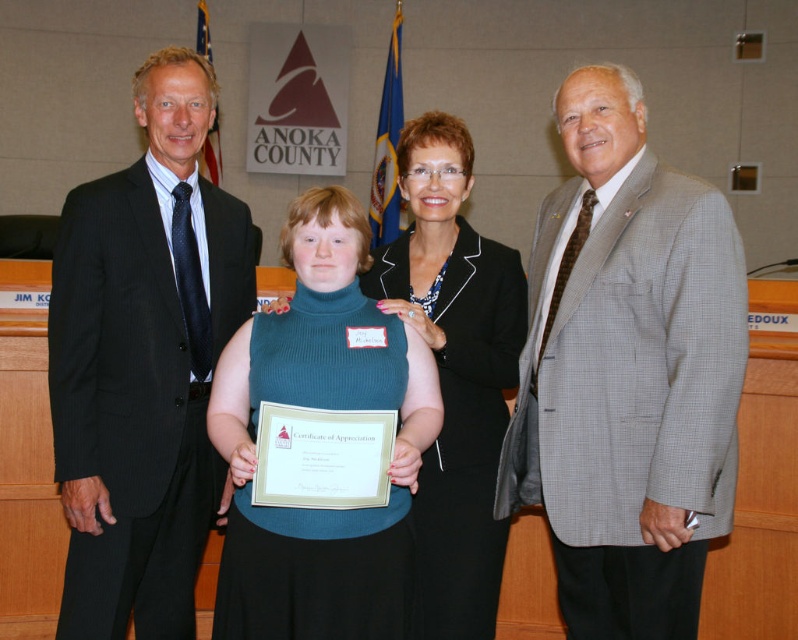
Does black suit at left appear on the right side of black wool suit at center?

In fact, black suit at left is to the left of black wool suit at center.

Is black suit at left behind black wool suit at center?

Yes, it is.

Find the location of a particular element. black suit at left is located at coordinates (143, 362).

Locate an element on the screen. This screenshot has height=640, width=798. black suit at left is located at coordinates (143, 362).

Does teal turtleneck sweater at center have a larger size compared to black wool suit at center?

Indeed, teal turtleneck sweater at center has a larger size compared to black wool suit at center.

Which is behind, point (362, 397) or point (439, 470)?

Positioned behind is point (439, 470).

In order to click on teal turtleneck sweater at center in this screenshot , I will do `click(324, 408)`.

Can you confirm if gray checkered suit at right is shorter than teal turtleneck sweater at center?

No.

Does gray checkered suit at right have a larger size compared to teal turtleneck sweater at center?

Yes, gray checkered suit at right is bigger than teal turtleneck sweater at center.

Does point (567, 628) come farther from viewer compared to point (336, 561)?

Yes, it is behind point (336, 561).

The image size is (798, 640). Find the location of `gray checkered suit at right`. gray checkered suit at right is located at coordinates (627, 372).